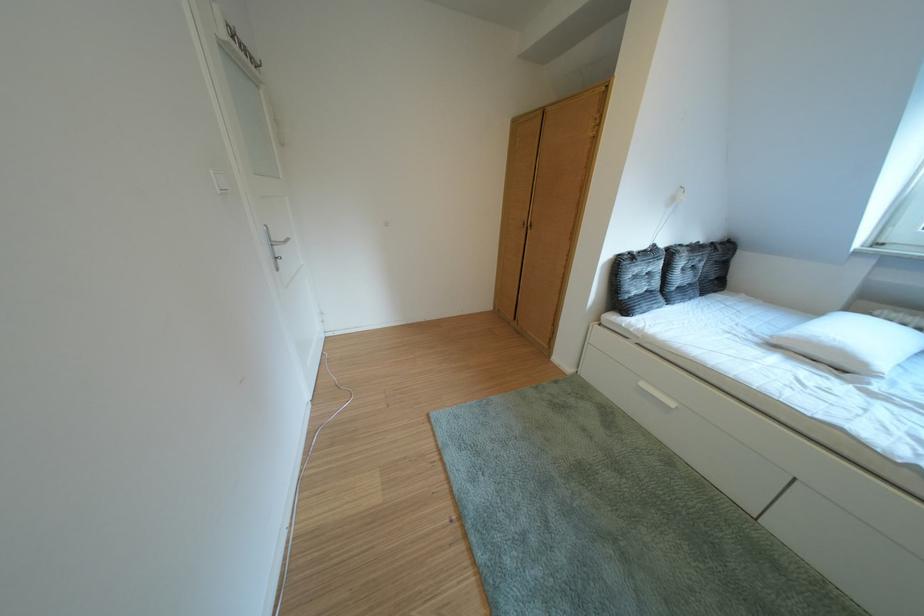
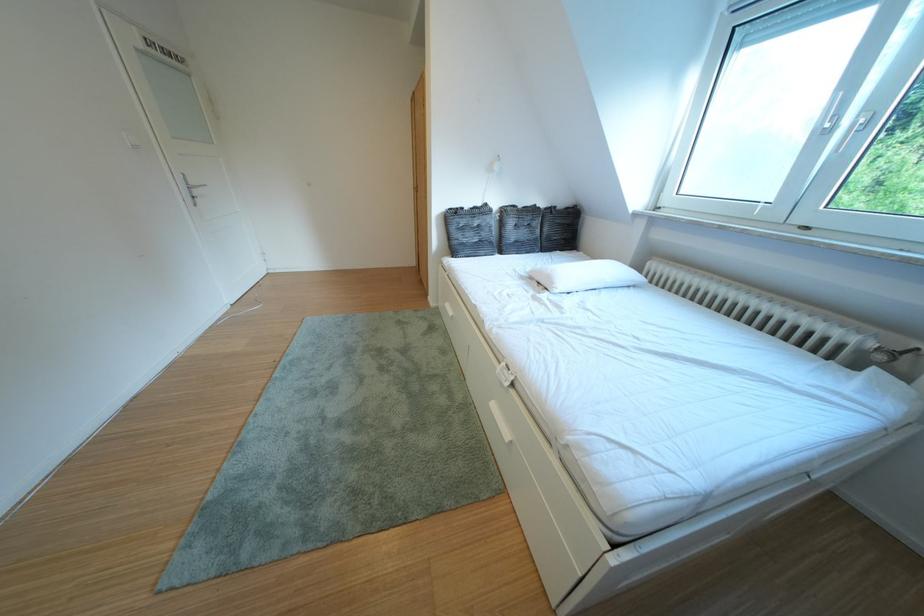
Find the pixel in the second image that matches point (658, 391) in the first image.

(460, 310)